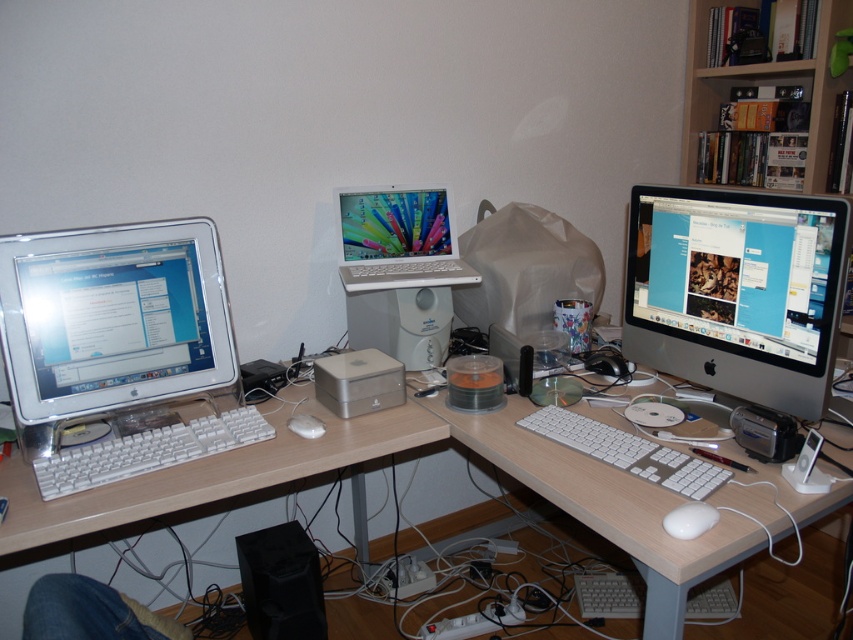
This screenshot has height=640, width=853. Find the location of `satin black monitor at upper right`. satin black monitor at upper right is located at coordinates (737, 291).

Between satin black monitor at upper right and wooden bookshelf at upper right, which one appears on the left side from the viewer's perspective?

satin black monitor at upper right is more to the left.

Identify the location of satin black monitor at upper right. (737, 291).

This screenshot has height=640, width=853. I want to click on satin black monitor at upper right, so click(x=737, y=291).

From the picture: Which is more to the right, wooden bookshelf at upper right or white plastic keyboard at lower center?

wooden bookshelf at upper right is more to the right.

Is point (700, 129) behind point (624, 596)?

That is True.

What are the coordinates of `wooden bookshelf at upper right` in the screenshot? It's located at (762, 83).

Which is below, white plastic laptop at center or white plastic keyboard at left?

Positioned lower is white plastic keyboard at left.

Does point (447, 253) lie behind point (135, 452)?

Yes, point (447, 253) is farther from viewer.

Is point (347, 257) positioned in front of point (134, 435)?

No, it is behind (134, 435).

Image resolution: width=853 pixels, height=640 pixels. Find the location of `white plastic laptop at center`. white plastic laptop at center is located at coordinates pyautogui.click(x=398, y=241).